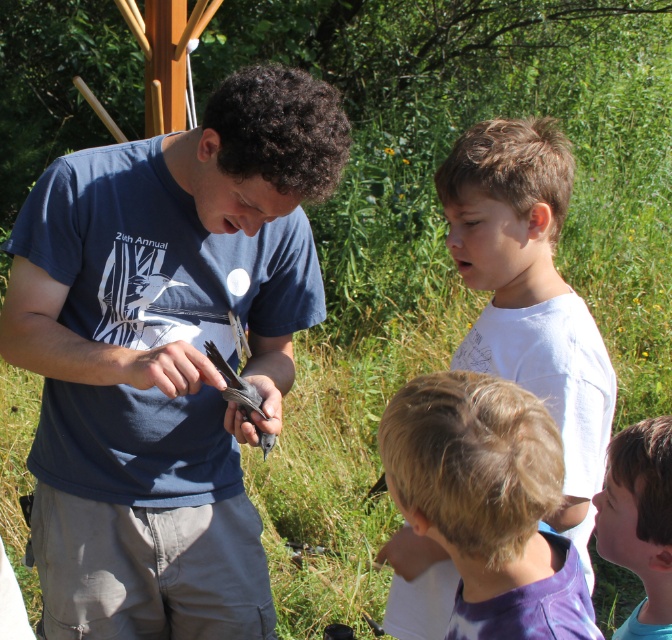
Looking at this image, is matte blue shirt at center to the right of blue tie-dye shirt at lower right from the viewer's perspective?

No, matte blue shirt at center is not to the right of blue tie-dye shirt at lower right.

The image size is (672, 640). Find the location of `matte blue shirt at center`. matte blue shirt at center is located at coordinates (167, 355).

Can you confirm if matte blue shirt at center is thinner than blonde hair at lower center?

No.

Can you confirm if matte blue shirt at center is wider than blonde hair at lower center?

Yes.

Who is more distant from viewer, (212, 465) or (509, 538)?

The point (212, 465) is more distant.

This screenshot has height=640, width=672. Identify the location of matte blue shirt at center. (167, 355).

Who is higher up, matte blue shirt at center or white cotton shirt at upper right?

Positioned higher is white cotton shirt at upper right.

Between point (155, 465) and point (491, 308), which one is positioned behind?

Point (491, 308)

This screenshot has height=640, width=672. I want to click on matte blue shirt at center, so click(x=167, y=355).